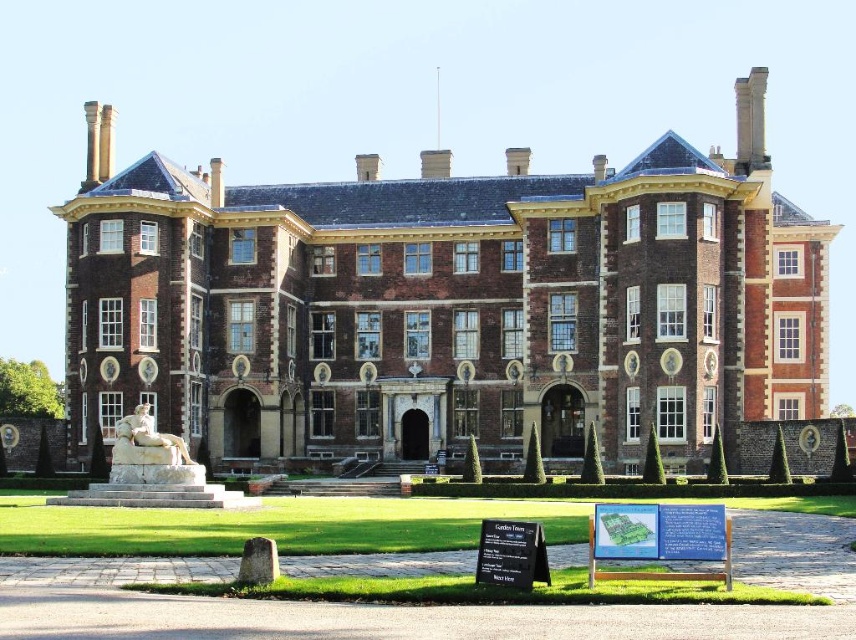
Question: Among these objects, which one is farthest from the camera?

Choices:
 (A) white marble statue at lower left
 (B) brown brick mansion at center

Answer: (B)

Question: Does brown brick mansion at center have a smaller size compared to white marble statue at lower left?

Choices:
 (A) no
 (B) yes

Answer: (A)

Question: Is brown brick mansion at center closer to camera compared to white marble statue at lower left?

Choices:
 (A) no
 (B) yes

Answer: (A)

Question: Can you confirm if brown brick mansion at center is bigger than white marble statue at lower left?

Choices:
 (A) yes
 (B) no

Answer: (A)

Question: Which object appears farthest from the camera in this image?

Choices:
 (A) brown brick mansion at center
 (B) white marble statue at lower left

Answer: (A)